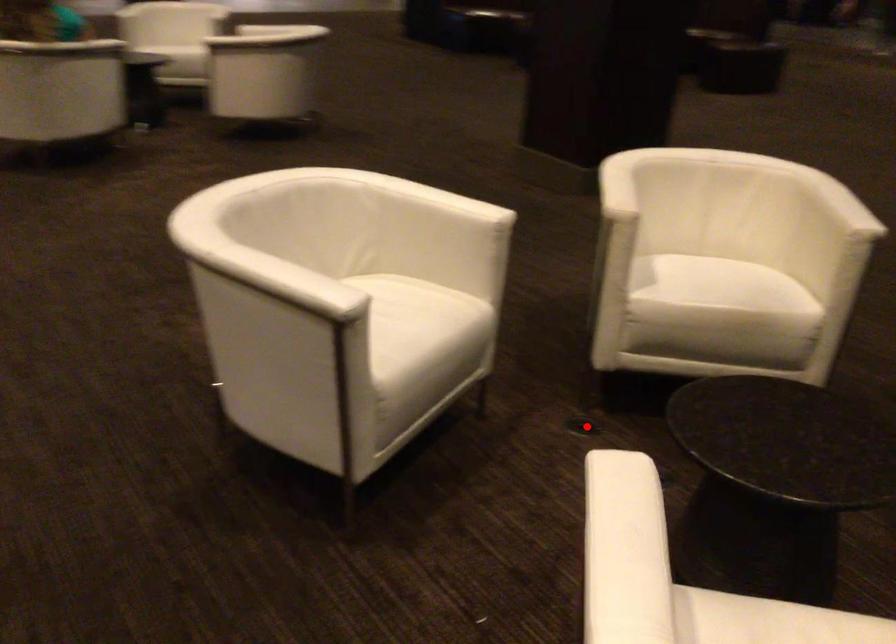
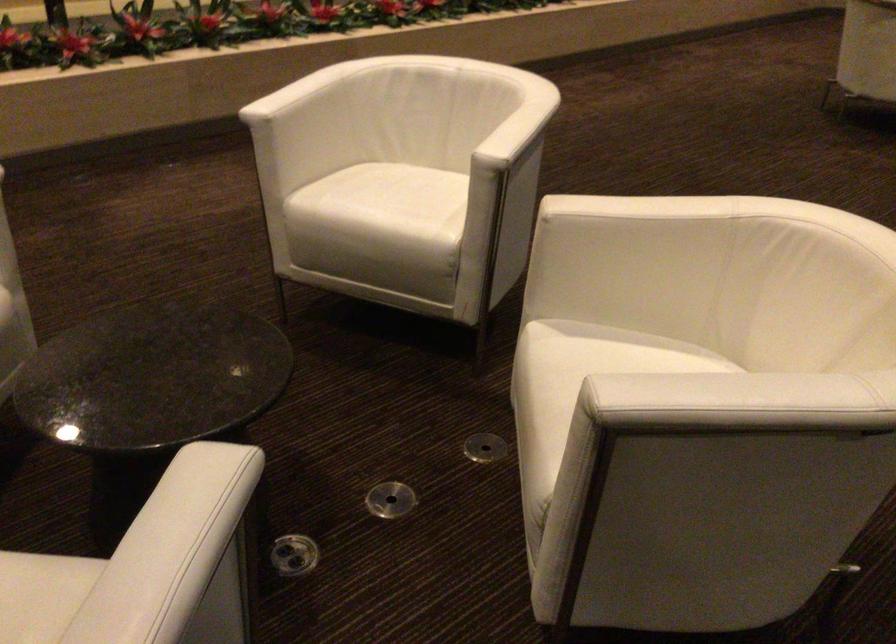
Where in the second image is the point corresponding to the highlighted location from the first image?

(484, 447)